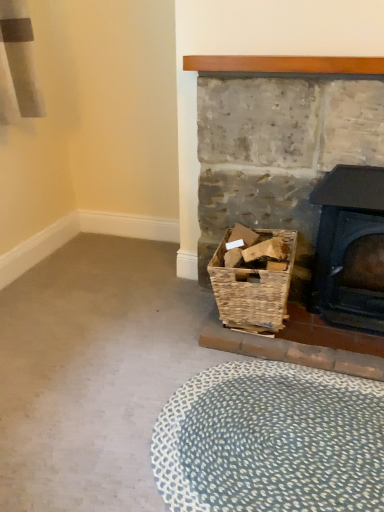
Question: Are woven brown basket at lower right and black cast iron wood burning stove at right beside each other?

Choices:
 (A) yes
 (B) no

Answer: (B)

Question: Considering the relative positions of woven brown basket at lower right and black cast iron wood burning stove at right in the image provided, is woven brown basket at lower right behind black cast iron wood burning stove at right?

Choices:
 (A) yes
 (B) no

Answer: (A)

Question: From a real-world perspective, is woven brown basket at lower right over black cast iron wood burning stove at right?

Choices:
 (A) yes
 (B) no

Answer: (B)

Question: Is black cast iron wood burning stove at right at the back of woven brown basket at lower right?

Choices:
 (A) no
 (B) yes

Answer: (A)

Question: Can you confirm if woven brown basket at lower right is wider than black cast iron wood burning stove at right?

Choices:
 (A) no
 (B) yes

Answer: (B)

Question: Is black cast iron wood burning stove at right to the left or to the right of blue textured rug at lower center in the image?

Choices:
 (A) left
 (B) right

Answer: (B)

Question: From a real-world perspective, is black cast iron wood burning stove at right above or below blue textured rug at lower center?

Choices:
 (A) below
 (B) above

Answer: (B)

Question: Considering the positions of point (317, 202) and point (254, 396), is point (317, 202) closer or farther from the camera than point (254, 396)?

Choices:
 (A) closer
 (B) farther

Answer: (B)

Question: Is black cast iron wood burning stove at right wider or thinner than blue textured rug at lower center?

Choices:
 (A) thin
 (B) wide

Answer: (A)

Question: Considering their positions, is blue textured rug at lower center located in front of or behind black cast iron wood burning stove at right?

Choices:
 (A) behind
 (B) front

Answer: (B)

Question: From a real-world perspective, is blue textured rug at lower center positioned above or below black cast iron wood burning stove at right?

Choices:
 (A) above
 (B) below

Answer: (B)

Question: Is blue textured rug at lower center bigger or smaller than black cast iron wood burning stove at right?

Choices:
 (A) small
 (B) big

Answer: (A)

Question: From the image's perspective, relative to black cast iron wood burning stove at right, is blue textured rug at lower center above or below?

Choices:
 (A) above
 (B) below

Answer: (B)

Question: From a real-world perspective, is rustic wicker basket at lower right physically located above or below woven brown basket at lower right?

Choices:
 (A) below
 (B) above

Answer: (B)

Question: From the image's perspective, relative to woven brown basket at lower right, is rustic wicker basket at lower right above or below?

Choices:
 (A) above
 (B) below

Answer: (A)